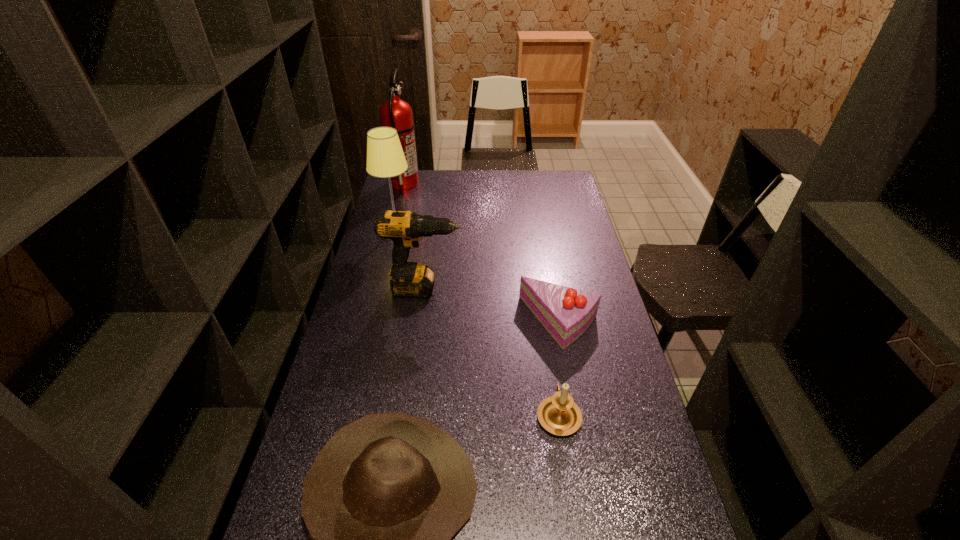
This screenshot has height=540, width=960. I want to click on vacant space located 0.250m with a handle on the side of the candle holder, so click(x=545, y=327).

Where is `vacant space positioned 0.170m with a handle on the side of the candle holder`? The width and height of the screenshot is (960, 540). vacant space positioned 0.170m with a handle on the side of the candle holder is located at coordinates (548, 346).

At what (x,y) coordinates should I click in order to perform the action: click on vacant position located 0.360m with a handle on the side of the candle holder. Please return your answer as a coordinate pair (x, y). Looking at the image, I should click on (541, 304).

Find the location of a particular element. The width and height of the screenshot is (960, 540). vacant area situated on the back of the cake is located at coordinates pyautogui.click(x=552, y=282).

The width and height of the screenshot is (960, 540). What are the coordinates of `object positioned at the far edge` in the screenshot? It's located at (396, 113).

Where is `fire extinguisher located in the left edge section of the desktop`? The image size is (960, 540). fire extinguisher located in the left edge section of the desktop is located at coordinates (396, 113).

Find the location of `table lamp that is positioned at the left edge`. table lamp that is positioned at the left edge is located at coordinates (385, 158).

Where is `drill that is at the left edge`? The image size is (960, 540). drill that is at the left edge is located at coordinates (x=409, y=279).

Identify the location of object located at the right edge. (566, 313).

Where is `object located in the far left corner section of the desktop`? The width and height of the screenshot is (960, 540). object located in the far left corner section of the desktop is located at coordinates (396, 113).